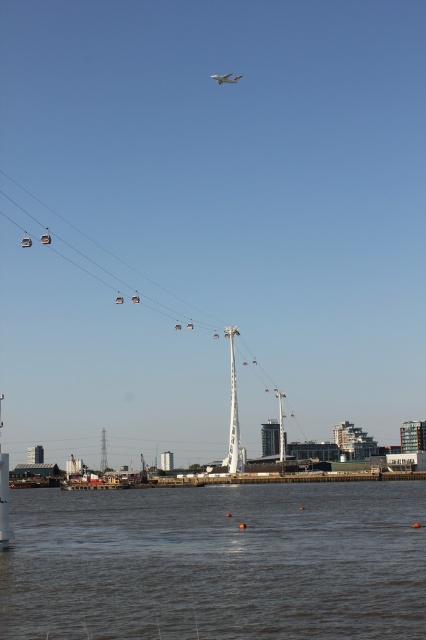
You are standing at the waterfront and looking at the brown water at lower center and the white matte airplane at upper center. Which object is positioned higher in the scene?

The white matte airplane at upper center is positioned higher than the brown water at lower center.

You are a photographer trying to capture both the metallic cable car at center and the white matte airplane at upper center in a single shot. Which object will appear bigger in your photo?

The metallic cable car at center will appear bigger in the photo because it has a larger size compared to the white matte airplane at upper center.

You are an architect designing a new observation deck. You need to ensure that the deck does not block the view of the white matte airplane at upper center from the brown water at lower center. Based on their heights, can the deck be placed between them without obstruction?

The brown water at lower center has a greater height compared to the white matte airplane at upper center. Therefore, placing the deck between them might block the view since the deck would be at a lower height than the water but higher than the airplane, potentially obstructing the line of sight.